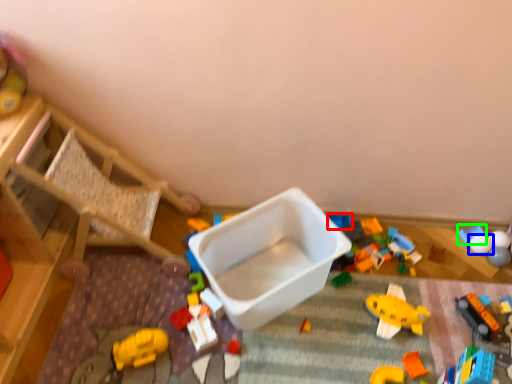
Question: Estimate the real-world distances between objects in this image. Which object is closer to toy (highlighted by a red box), toy (highlighted by a blue box) or toy (highlighted by a green box)?

Choices:
 (A) toy
 (B) toy

Answer: (B)